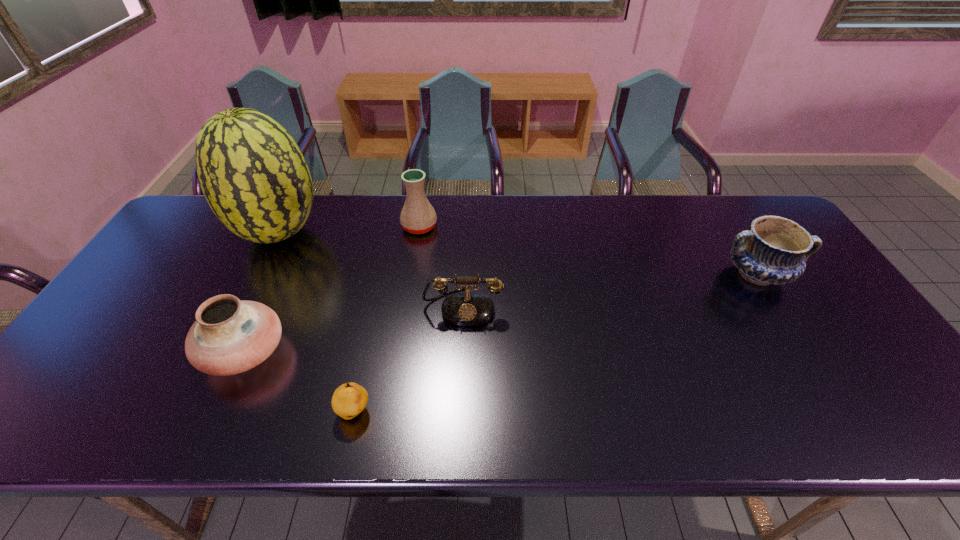
Locate an element on the screen. The height and width of the screenshot is (540, 960). vacant area between the farthest pottery and the tallest object is located at coordinates (349, 230).

At what (x,y) coordinates should I click in order to perform the action: click on free space that is in between the pear and the nearest pottery. Please return your answer as a coordinate pair (x, y). Looking at the image, I should click on (300, 382).

At what (x,y) coordinates should I click in order to perform the action: click on vacant space that's between the second pottery from left to right and the watermelon. Please return your answer as a coordinate pair (x, y). The width and height of the screenshot is (960, 540). Looking at the image, I should click on (349, 230).

Where is `free point between the fifth shortest object and the leftmost pottery`? The height and width of the screenshot is (540, 960). free point between the fifth shortest object and the leftmost pottery is located at coordinates (332, 289).

Identify which object is located as the nearest to the second farthest pottery. Please provide its 2D coordinates. Your answer should be formatted as a tuple, i.e. [(x, y)], where the tuple contains the x and y coordinates of a point satisfying the conditions above.

[(468, 308)]

Where is `the fifth closest object to the nearest object`? This screenshot has width=960, height=540. the fifth closest object to the nearest object is located at coordinates tap(774, 251).

Where is `the closest pottery relative to the watermelon`? The width and height of the screenshot is (960, 540). the closest pottery relative to the watermelon is located at coordinates (230, 336).

Identify which pottery is the nearest to the rightmost pottery. Please provide its 2D coordinates. Your answer should be formatted as a tuple, i.e. [(x, y)], where the tuple contains the x and y coordinates of a point satisfying the conditions above.

[(418, 216)]